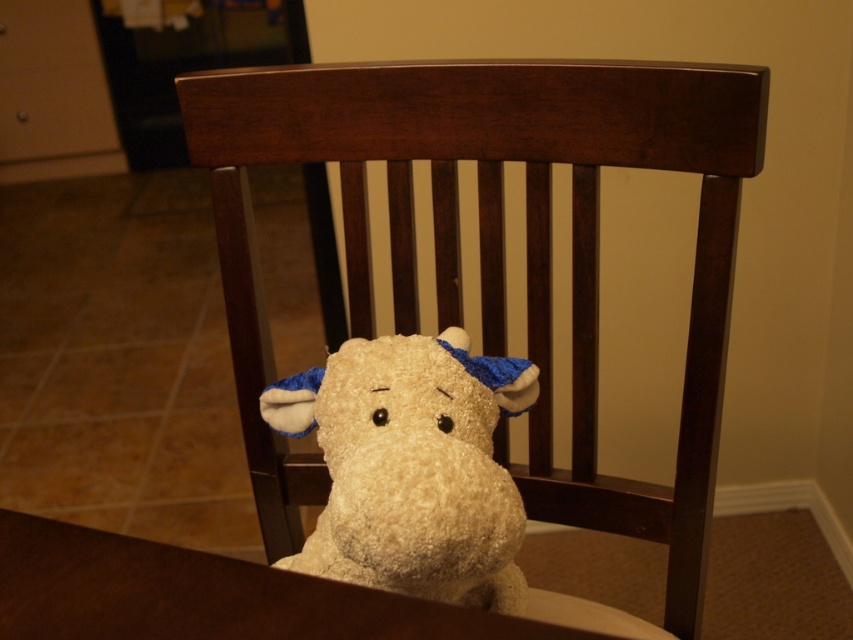
You are a child who wants to sit on the wooden rocking chair at center. Is the fluffy beige stuffed animal at center in a place where it might fall off when you sit down?

The wooden rocking chair at center is positioned over the fluffy beige stuffed animal at center, so the stuffed animal is likely underneath the chair. When you sit down, it might get displaced or fall off.

In the scene shown: You are organizing a toy shelf and need to place both the fluffy white stuffed animal at center and the fluffy beige stuffed animal at center. Which one requires more space due to its size?

The fluffy white stuffed animal at center requires more space because it is larger in size than the fluffy beige stuffed animal at center.

You are standing in the room and want to place a small plant pot on the floor directly in front of the wooden rocking chair at center. According to the image, where should you place the plant pot?

The wooden rocking chair at center is located at point (494, 250). To place the plant pot directly in front of it, position it on the floor at the same x coordinate 0.391 but lower y coordinate, such as 0.5 or lower, depending on the room layout.